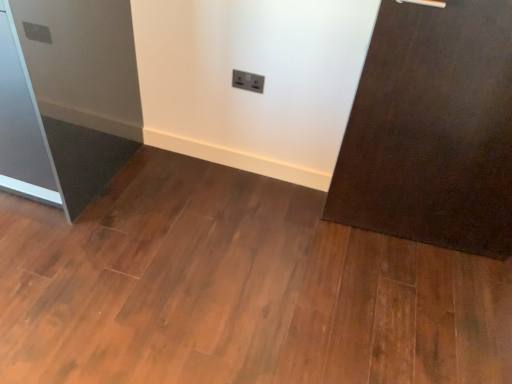
Question: Would you say satin silver fridge at left is inside or outside white plastic electric outlet at center?

Choices:
 (A) inside
 (B) outside

Answer: (B)

Question: From the image's perspective, is satin silver fridge at left above or below white plastic electric outlet at center?

Choices:
 (A) below
 (B) above

Answer: (A)

Question: Is satin silver fridge at left bigger or smaller than white plastic electric outlet at center?

Choices:
 (A) small
 (B) big

Answer: (B)

Question: Looking at their shapes, would you say white plastic electric outlet at center is wider or thinner than satin silver fridge at left?

Choices:
 (A) thin
 (B) wide

Answer: (A)

Question: Looking at the image, does white plastic electric outlet at center seem bigger or smaller compared to satin silver fridge at left?

Choices:
 (A) small
 (B) big

Answer: (A)

Question: Is white plastic electric outlet at center situated inside satin silver fridge at left or outside?

Choices:
 (A) outside
 (B) inside

Answer: (A)

Question: From a real-world perspective, is white plastic electric outlet at center positioned above or below satin silver fridge at left?

Choices:
 (A) above
 (B) below

Answer: (A)